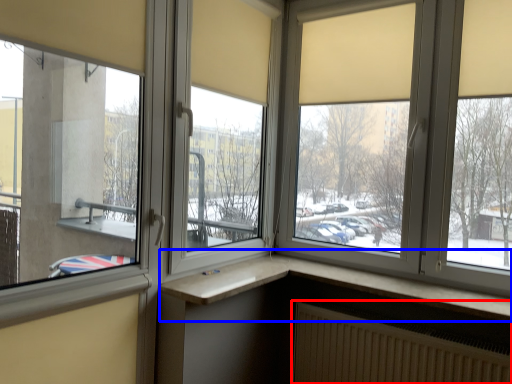
Question: Which object appears closest to the camera in this image, radiator (highlighted by a red box) or window (highlighted by a blue box)?

Choices:
 (A) radiator
 (B) window

Answer: (A)